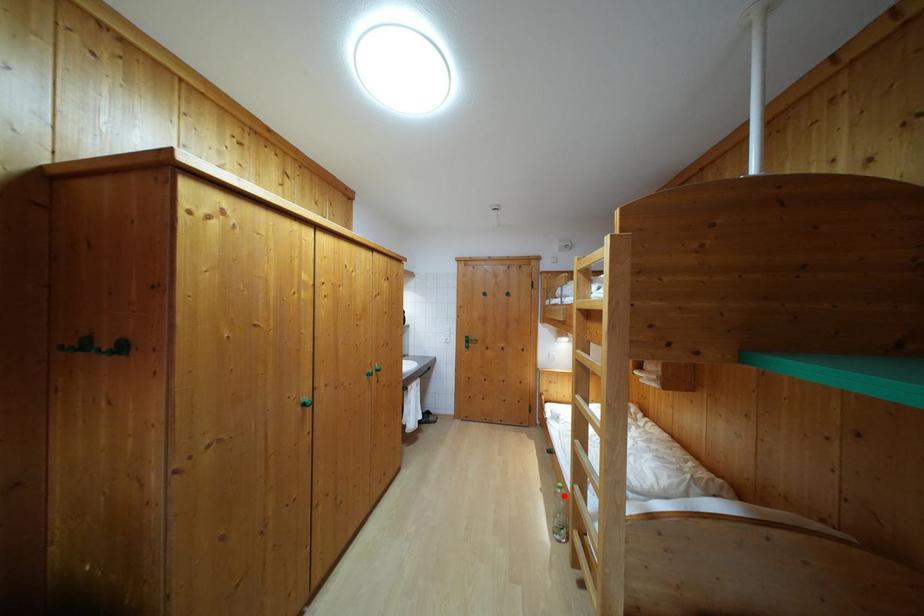
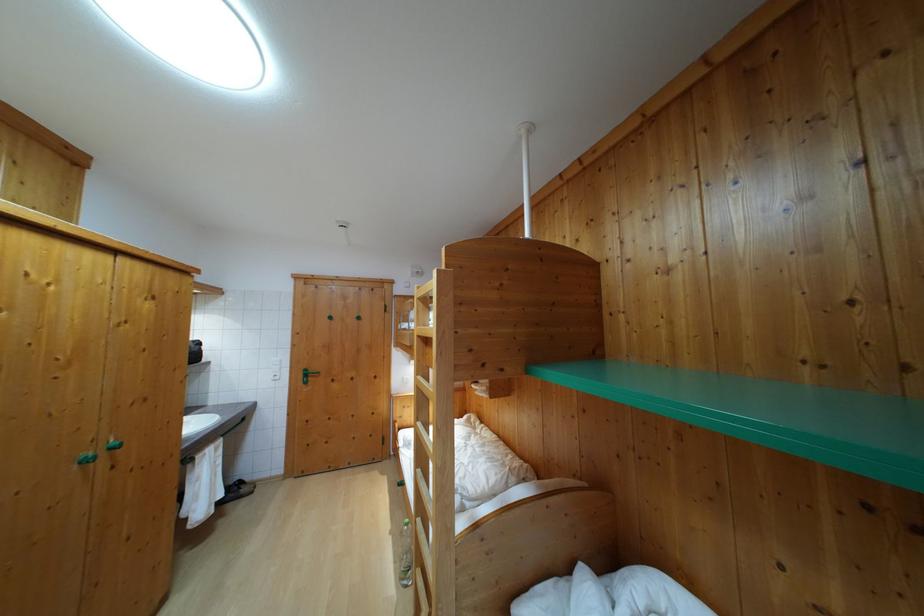
Find the pixel in the second image that matches the highlighted location in the first image.

(410, 532)